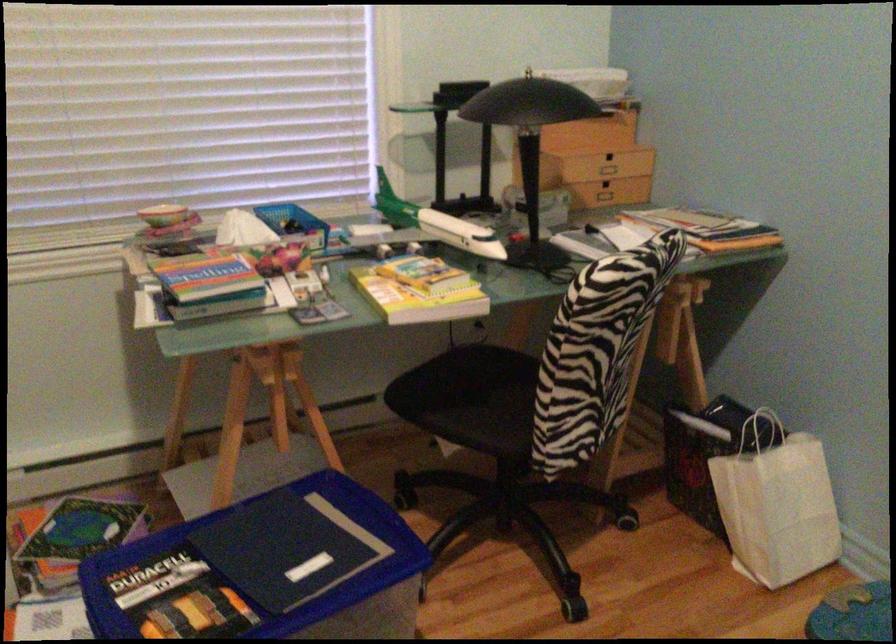
The width and height of the screenshot is (896, 644). Describe the element at coordinates (761, 431) in the screenshot. I see `the white paper bag handle` at that location.